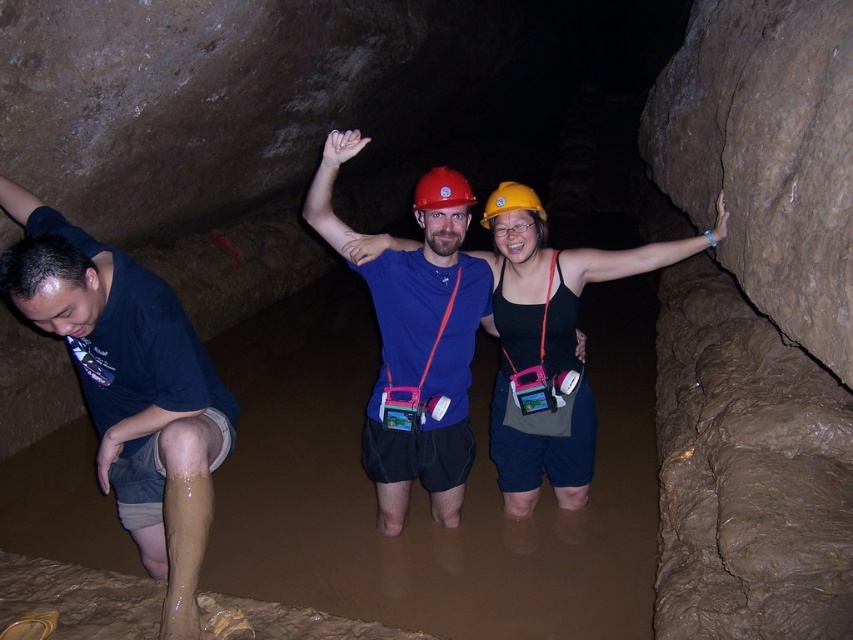
Is the position of dark blue t-shirt at lower left more distant than that of yellow matte helmet at center?

That is False.

Which is behind, point (151, 483) or point (531, 196)?

Point (531, 196)

Where is `dark blue t-shirt at lower left`? dark blue t-shirt at lower left is located at coordinates (129, 388).

From the picture: Does red matte helmet at center appear on the right side of yellow matte helmet at center?

No, red matte helmet at center is not to the right of yellow matte helmet at center.

Locate an element on the screen. This screenshot has width=853, height=640. red matte helmet at center is located at coordinates (440, 189).

Between point (444, 189) and point (531, 193), which one is positioned behind?

Point (531, 193)

You are a GUI agent. You are given a task and a screenshot of the screen. Output one action in this format:
    pyautogui.click(x=<x>, y=<y>)
    Task: Click on the red matte helmet at center
    The image size is (853, 640).
    Given the screenshot: What is the action you would take?
    pyautogui.click(x=440, y=189)

This screenshot has width=853, height=640. Identify the location of dark blue t-shirt at lower left. coord(129,388).

Which is in front, point (210, 504) or point (445, 179)?

Point (210, 504) is more forward.

You are a GUI agent. You are given a task and a screenshot of the screen. Output one action in this format:
    pyautogui.click(x=<x>, y=<y>)
    Task: Click on the dark blue t-shirt at lower left
    This screenshot has height=640, width=853.
    Given the screenshot: What is the action you would take?
    pyautogui.click(x=129, y=388)